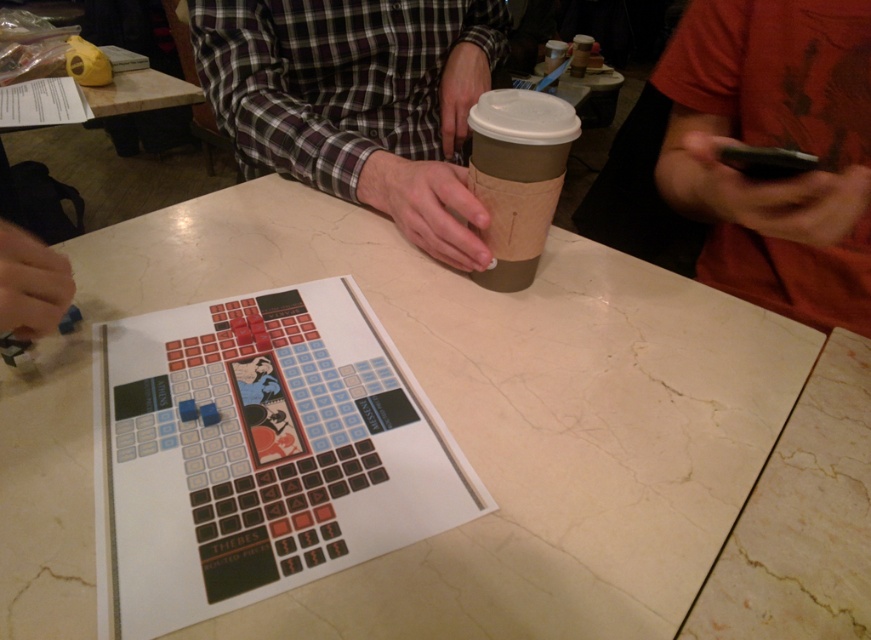
Question: Which of the following is the closest to the observer?

Choices:
 (A) (79, 538)
 (B) (206, 28)
 (C) (811, 236)

Answer: (A)

Question: Which is farther from the white marble table at center?

Choices:
 (A) orange cotton shirt at upper right
 (B) plaid shirt at center

Answer: (A)

Question: Is white marble table at center to the left of orange cotton shirt at upper right from the viewer's perspective?

Choices:
 (A) yes
 (B) no

Answer: (A)

Question: Can you confirm if white marble table at center is positioned to the right of orange cotton shirt at upper right?

Choices:
 (A) no
 (B) yes

Answer: (A)

Question: Does white marble table at center come in front of plaid shirt at center?

Choices:
 (A) yes
 (B) no

Answer: (A)

Question: Which object is positioned farthest from the white marble table at center?

Choices:
 (A) orange cotton shirt at upper right
 (B) plaid shirt at center

Answer: (A)